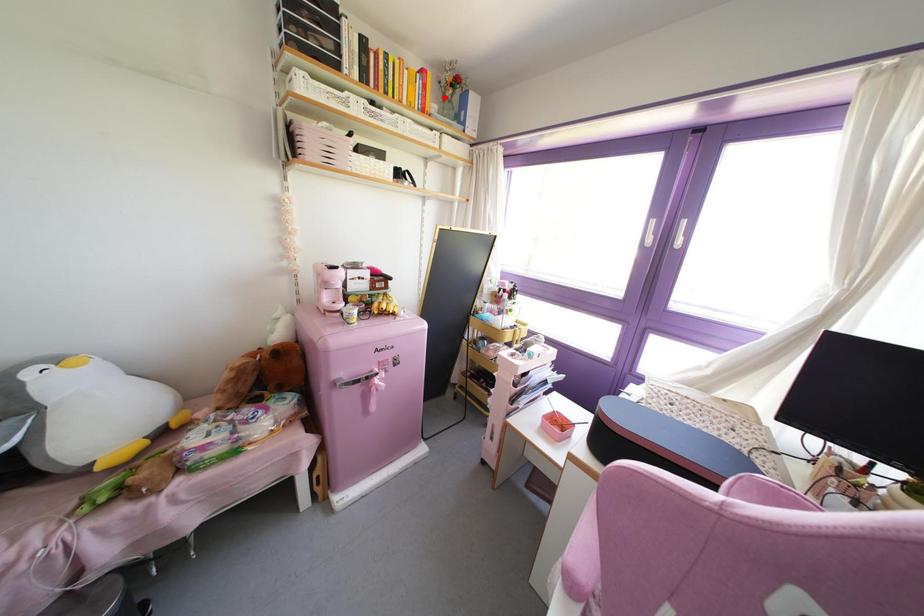
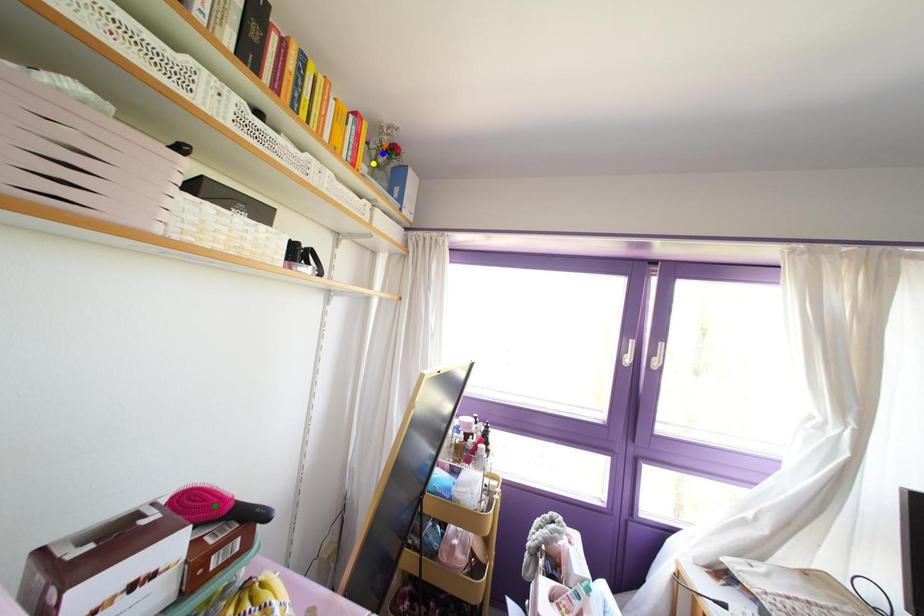
Question: I am providing you with two images of the same scene from different viewpoints. A red point is marked on the first image. You are given multiple points on the second image. Can you choose the point in image 2 that corresponds to the point in image 1?

Choices:
 (A) blue point
 (B) yellow point
 (C) green point

Answer: (B)